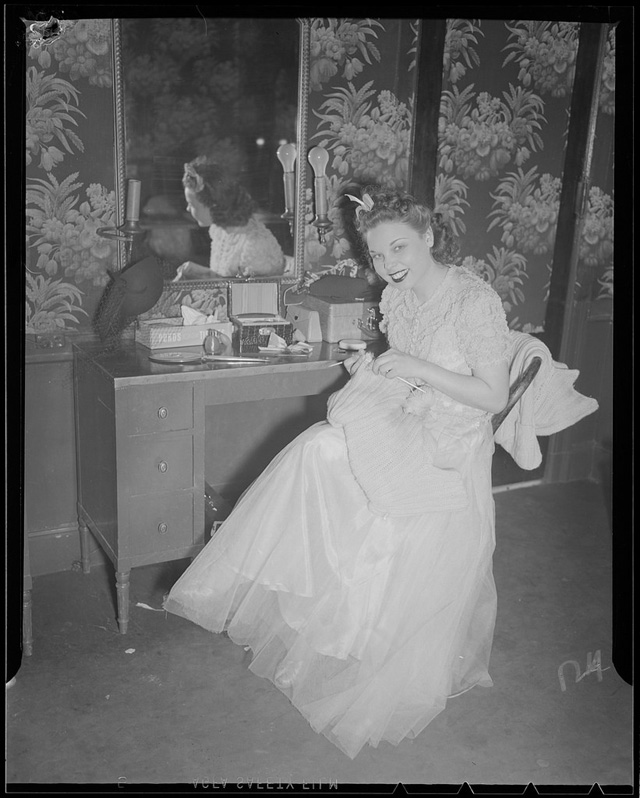
Where is `floor`? This screenshot has width=640, height=798. floor is located at coordinates (132, 700).